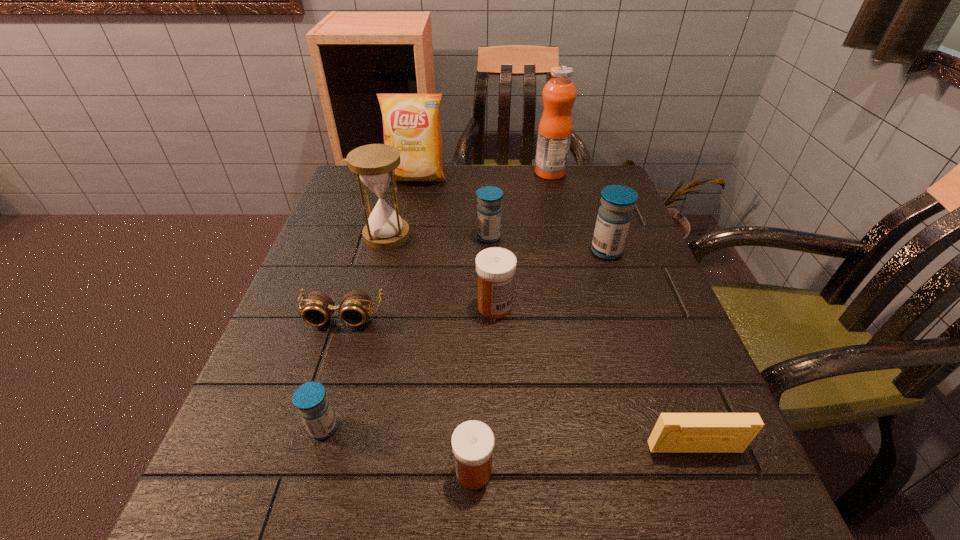
Locate an element on the screen. the nearer white medicine is located at coordinates pyautogui.click(x=472, y=441).

Identify the location of the fourth farthest medicine. (310, 398).

At what (x,y) coordinates should I click in order to perform the action: click on the nearest blue medicine. Please return your answer as a coordinate pair (x, y). Image resolution: width=960 pixels, height=540 pixels. Looking at the image, I should click on (310, 398).

Image resolution: width=960 pixels, height=540 pixels. In order to click on beige videotape in this screenshot , I will do `click(673, 432)`.

In order to click on brown goggles in this screenshot , I will do `click(354, 308)`.

Locate an element on the screen. The width and height of the screenshot is (960, 540). the shortest object is located at coordinates (354, 308).

Where is `free region located 0.360m on the front of the tallest object`? This screenshot has width=960, height=540. free region located 0.360m on the front of the tallest object is located at coordinates (572, 264).

Find the location of a particular element. The height and width of the screenshot is (540, 960). free space located on the front-facing side of the crisp (potato chip) is located at coordinates (412, 204).

You are a GUI agent. You are given a task and a screenshot of the screen. Output one action in this format:
    pyautogui.click(x=<x>, y=<y>)
    Task: Click on the vacant space located on the back of the white hourglass
    
    Given the screenshot: What is the action you would take?
    pyautogui.click(x=400, y=185)

Find the location of a particular element. vacant space located 0.200m on the back of the fourth tallest object is located at coordinates (588, 195).